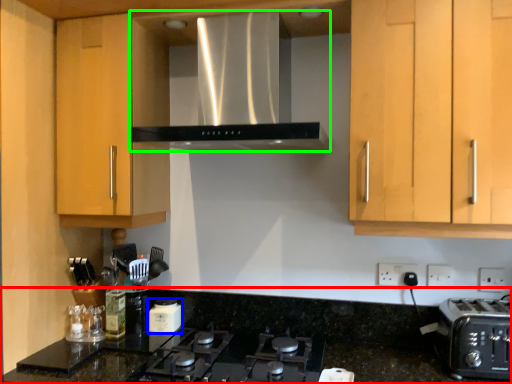
Question: Which object is positioned farthest from countertop (highlighted by a red box)? Select from kitchen appliance (highlighted by a blue box) and home appliance (highlighted by a green box).

Choices:
 (A) kitchen appliance
 (B) home appliance

Answer: (B)